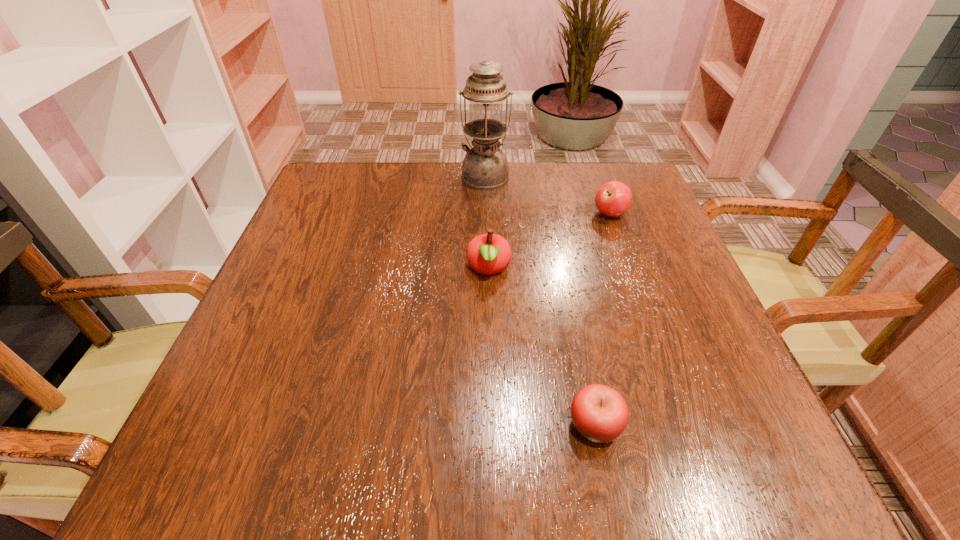
Image resolution: width=960 pixels, height=540 pixels. Find the location of `free space between the leftmost apple and the farthest apple`. free space between the leftmost apple and the farthest apple is located at coordinates (549, 241).

Where is `blank region between the second farthest apple and the nearest object`? Image resolution: width=960 pixels, height=540 pixels. blank region between the second farthest apple and the nearest object is located at coordinates (541, 347).

The image size is (960, 540). Identify the location of free space between the nearest object and the rightmost apple. (603, 320).

This screenshot has height=540, width=960. In order to click on free point between the oil lamp and the rightmost apple in this screenshot , I will do `click(547, 195)`.

The width and height of the screenshot is (960, 540). I want to click on object that stands as the second closest to the second object from right to left, so click(614, 198).

Identify which object is the closest to the rightmost apple. Please provide its 2D coordinates. Your answer should be formatted as a tuple, i.e. [(x, y)], where the tuple contains the x and y coordinates of a point satisfying the conditions above.

[(485, 166)]

Choose which apple is the nearest neighbor to the third farthest object. Please provide its 2D coordinates. Your answer should be formatted as a tuple, i.e. [(x, y)], where the tuple contains the x and y coordinates of a point satisfying the conditions above.

[(614, 198)]

Locate which apple is the second closest to the nearest object. Please provide its 2D coordinates. Your answer should be formatted as a tuple, i.e. [(x, y)], where the tuple contains the x and y coordinates of a point satisfying the conditions above.

[(614, 198)]

Locate an element on the screen. vacant space that satisfies the following two spatial constraints: 1. on the front side of the leftmost apple; 2. on the right side of the second apple from left to right is located at coordinates (492, 425).

The height and width of the screenshot is (540, 960). In order to click on vacant region that satisfies the following two spatial constraints: 1. on the front side of the second apple from right to left; 2. on the right side of the leftmost apple in this screenshot , I will do `click(492, 425)`.